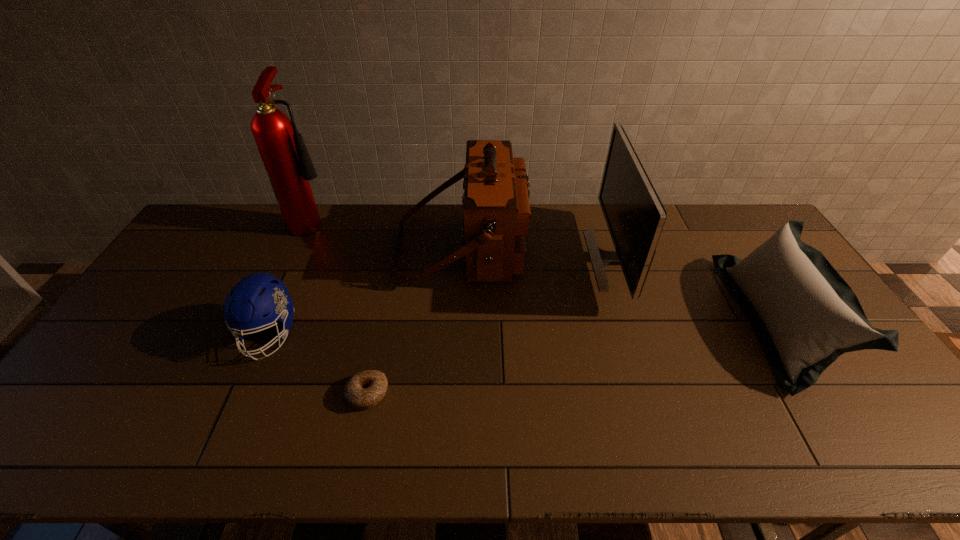
Locate an element on the screen. free space at the far edge is located at coordinates pyautogui.click(x=341, y=215).

Locate an element on the screen. free space at the near edge of the desktop is located at coordinates (152, 454).

I want to click on vacant space at the left edge, so pyautogui.click(x=204, y=247).

The width and height of the screenshot is (960, 540). What are the coordinates of `vacant region at the right edge of the desktop` in the screenshot? It's located at (831, 374).

Locate an element on the screen. vacant region at the far right corner of the desktop is located at coordinates (759, 223).

Where is `free space that is in between the football helmet and the second object from right to left`? free space that is in between the football helmet and the second object from right to left is located at coordinates (442, 297).

What are the coordinates of `vacant region between the shortest object and the fire extinguisher` in the screenshot? It's located at (341, 307).

This screenshot has width=960, height=540. What are the coordinates of `vacant area that lies between the rightmost object and the monitor` in the screenshot? It's located at (696, 289).

Find the location of a particular element. The image size is (960, 540). empty space that is in between the satchel and the shortest object is located at coordinates (415, 320).

Identify the location of vacant space that's between the rightmost object and the fifth object from left to right. (696, 289).